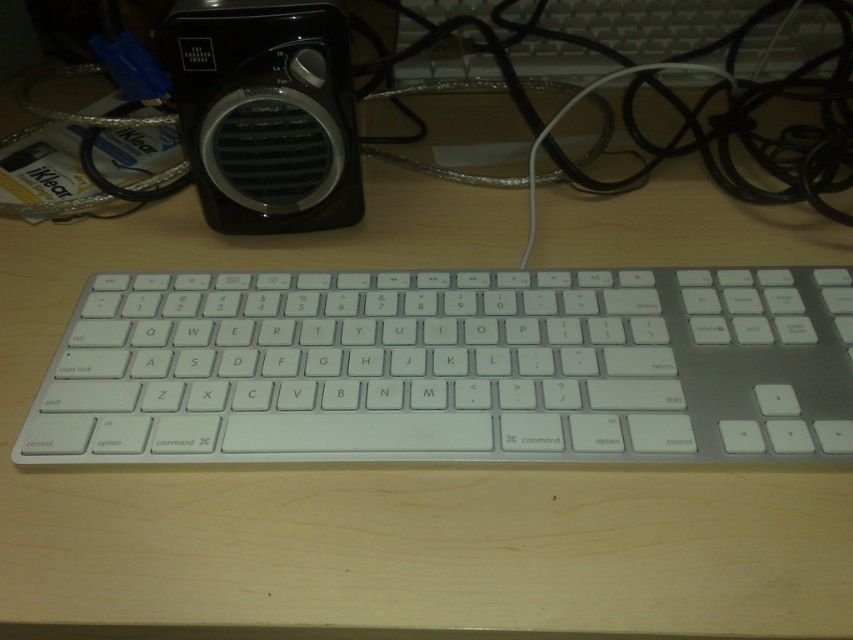
Question: Is sleek silver keyboard at center below black plastic speaker at upper left?

Choices:
 (A) yes
 (B) no

Answer: (A)

Question: Is sleek silver keyboard at center further to the viewer compared to black plastic speaker at upper left?

Choices:
 (A) yes
 (B) no

Answer: (B)

Question: In this image, where is sleek silver keyboard at center located relative to black plastic speaker at upper left?

Choices:
 (A) above
 (B) below

Answer: (B)

Question: Which point is farther to the camera?

Choices:
 (A) sleek silver keyboard at center
 (B) black plastic speaker at upper left

Answer: (B)